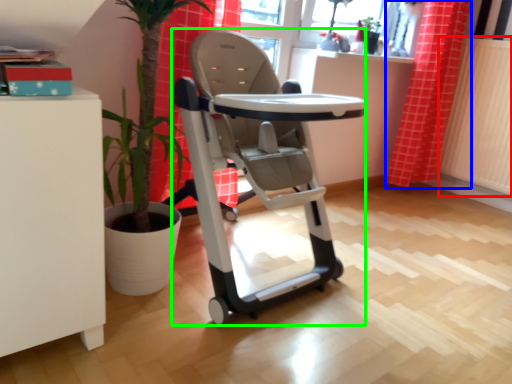
Question: Which is farther away from radiator (highlighted by a red box)? curtain (highlighted by a blue box) or baby carriage (highlighted by a green box)?

Choices:
 (A) curtain
 (B) baby carriage

Answer: (B)